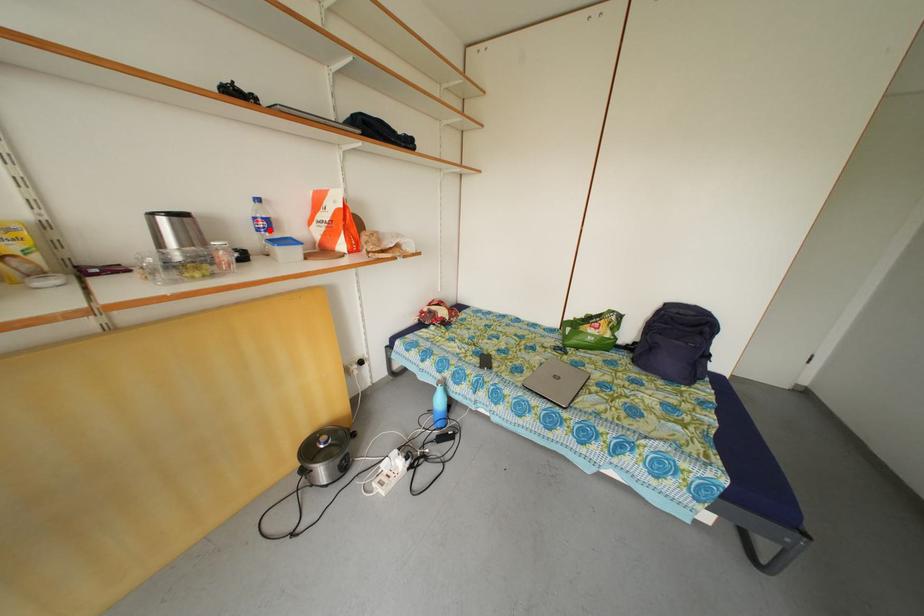
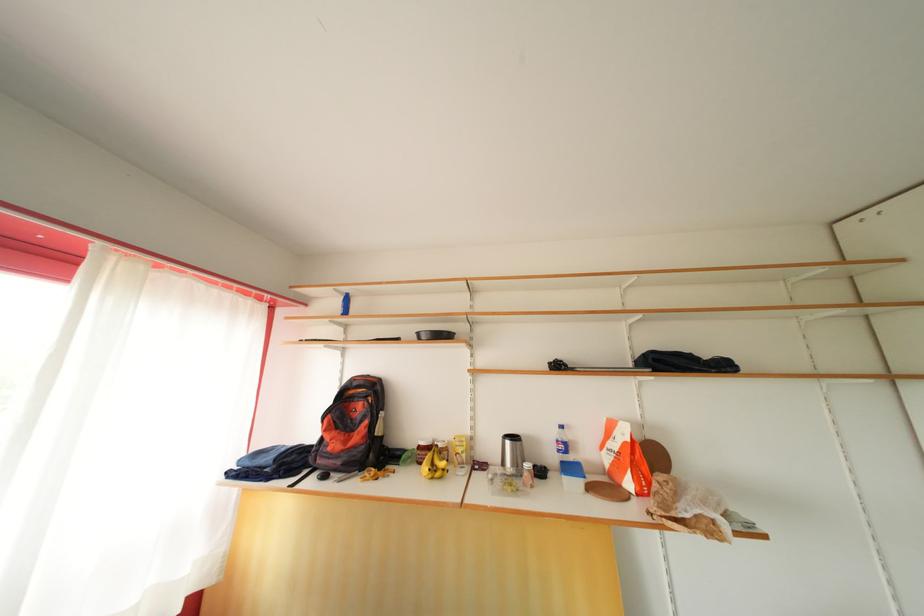
Find the pixel in the second image that matches the highlighted location in the first image.

(568, 453)